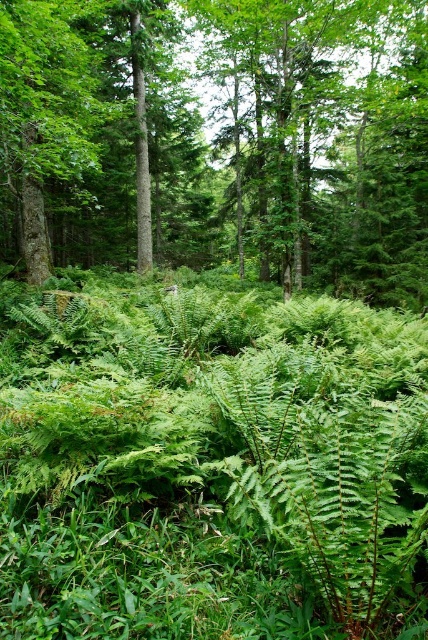
Question: Can you confirm if green leafy grass at center is thinner than green leafy tree at center?

Choices:
 (A) no
 (B) yes

Answer: (B)

Question: Can you confirm if green leafy grass at center is positioned to the left of green leafy tree at center?

Choices:
 (A) no
 (B) yes

Answer: (B)

Question: In this image, where is green leafy grass at center located relative to green leafy tree at center?

Choices:
 (A) below
 (B) above

Answer: (A)

Question: Which object appears closest to the camera in this image?

Choices:
 (A) green leafy tree at center
 (B) green leafy grass at center

Answer: (B)